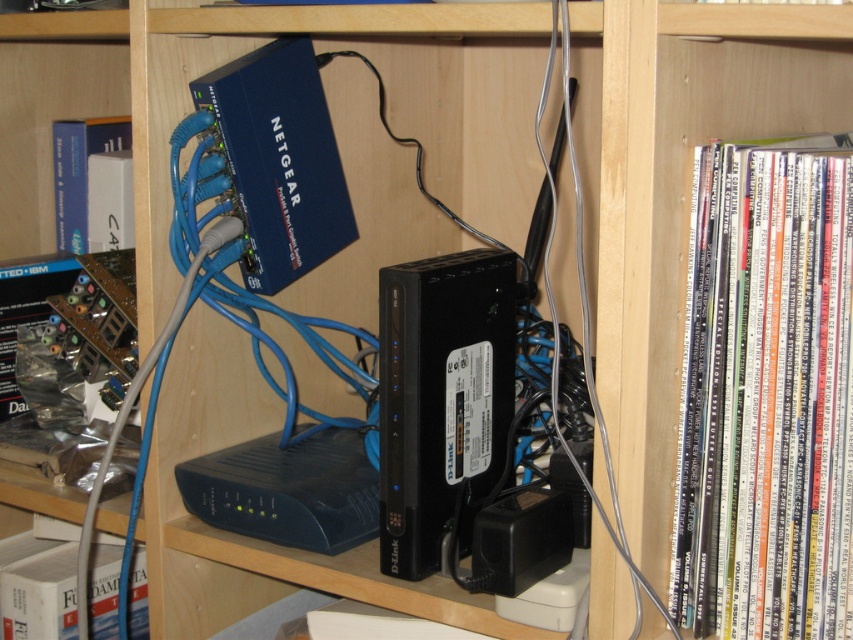
You are organizing a bookshelf and need to place a new book. You see the white paperbacks at right and the white paper book at lower left. Which one is closer to you?

The white paperbacks at right are closer to you because they are in front of the white paper book at lower left.

You are organizing a bookshelf and need to place a new book that requires at least 30 inches of space between two existing books. Looking at the white paperbacks at right and the white matte book at left on the shelf, will there be enough space between them to fit your new book?

The white paperbacks at right and white matte book at left are 28.90 inches apart from each other. Since the required space is 30 inches, there isn not enough space between them to fit the new book.

You need to place a new book on the shelf where the white paperbacks at right are located. According to the scene description, can you determine the exact coordinates where you should place the new book?

The white paperbacks at right are located at point (766,394), so you should place the new book at those coordinates.